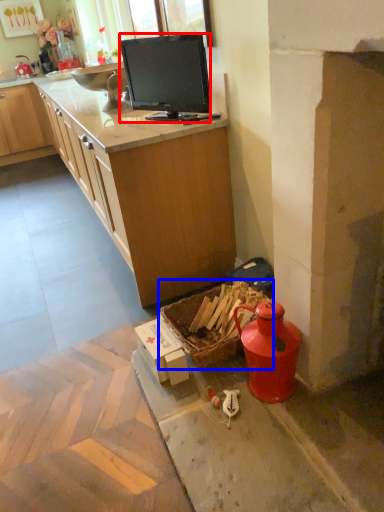
Question: Which object is further to the camera taking this photo, television (highlighted by a red box) or picnic basket (highlighted by a blue box)?

Choices:
 (A) television
 (B) picnic basket

Answer: (A)